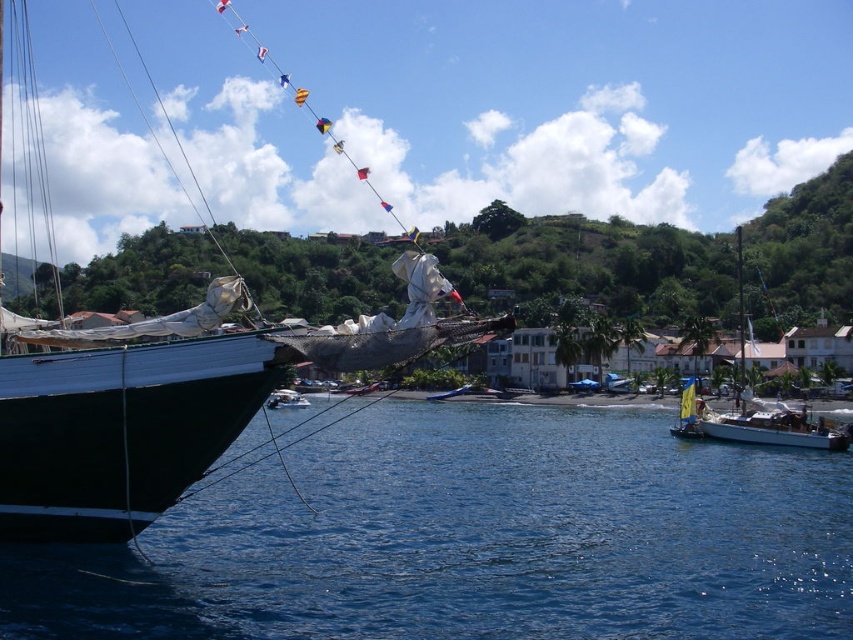
You are standing on the deck of the white matte sailboat at right and want to pour a drink into the blue liquid water at lower left. Can you do this without moving from your current position?

The blue liquid water at lower left is closer to the viewer than the white matte sailboat at right, so yes, you can pour the drink into the blue liquid water at lower left from your current position on the white matte sailboat at right since it is within reach.

You are navigating a boat and need to dock at the white glossy sailboat at lower right. Based on the coordinates provided in the scene description, can you determine the direction you should head from the current position at the bow of the dark sailboat?

The white glossy sailboat at lower right is located at coordinates point (x=773, y=428). Since your current position is at the bow of the dark sailboat, you should head towards the lower right direction to reach it.

You are navigating a boat and need to dock at the white glossy sailboat at lower right. From your current position near the white matte sailboat at center, in which direction should you steer your boat?

You should steer your boat to the right to reach the white glossy sailboat at lower right since it is located to the right of the white matte sailboat at center.